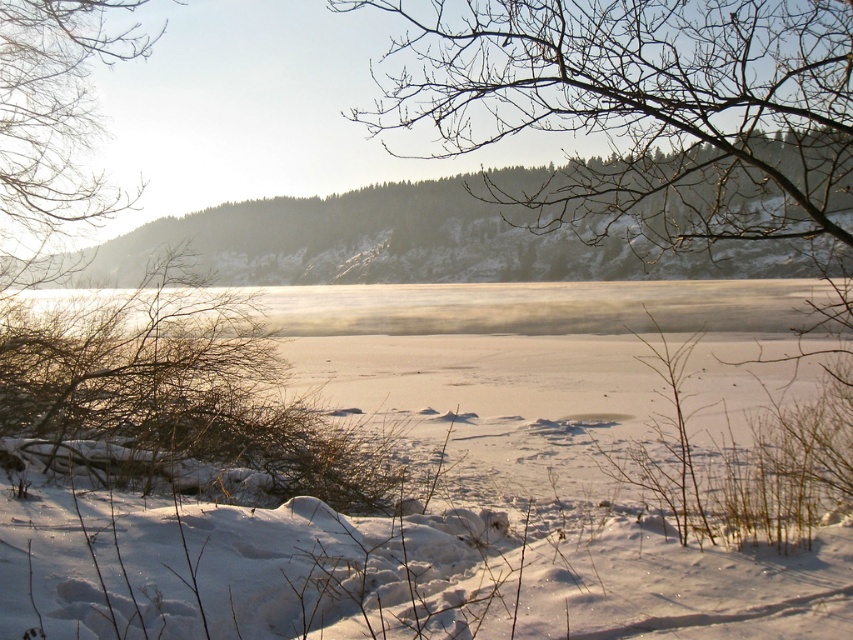
You are an artist sketching this winter scene. You need to decide which object to draw first based on their size. Which one should you start with, the bare branches at upper center or the green textured hillside at upper center?

The bare branches at upper center is bigger than the green textured hillside at upper center, so you should start with the bare branches at upper center.

You are an artist sketching the winter scene. You want to ensure the bare branches at upper center and the translucent ice at center are proportionally accurate. Which object should you draw taller in your sketch?

The bare branches at upper center should be drawn taller than the translucent ice at center because the description states that the bare branches at upper center has a greater height compared to the translucent ice at center.

You are an outdoor photographer planning to capture the green textured hillside at upper center and the translucent ice at center in a single shot. Based on their sizes in the scene, which object should you focus on first to ensure both are in frame?

The green textured hillside at upper center is taller than the translucent ice at center, so you should focus on the green textured hillside at upper center first to ensure both are in frame.